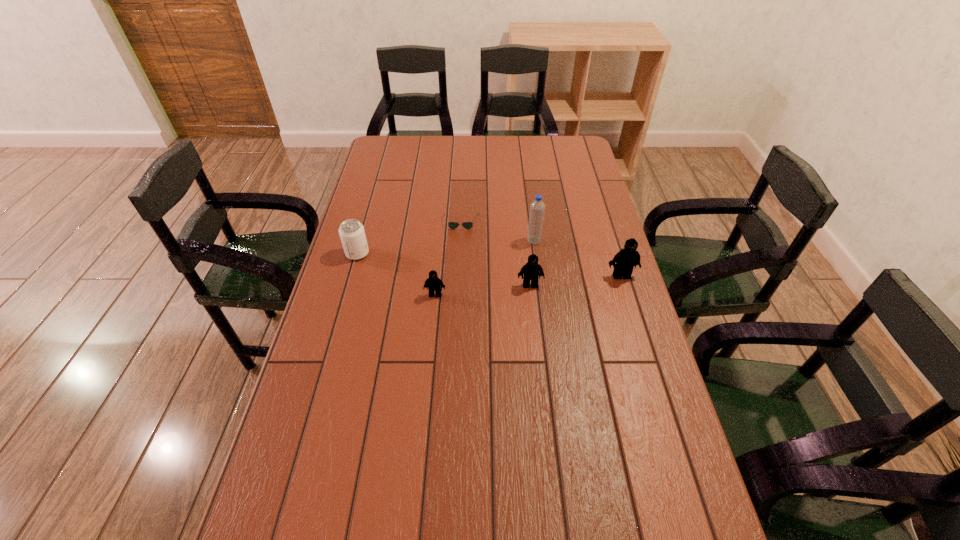
You are a GUI agent. You are given a task and a screenshot of the screen. Output one action in this format:
    pyautogui.click(x=<x>, y=<y>)
    Task: Click on the free space that satisfies the following two spatial constraints: 1. on the lenses of the fifth nearest object; 2. on the right side of the shortest object
    
    Given the screenshot: What is the action you would take?
    pyautogui.click(x=460, y=241)